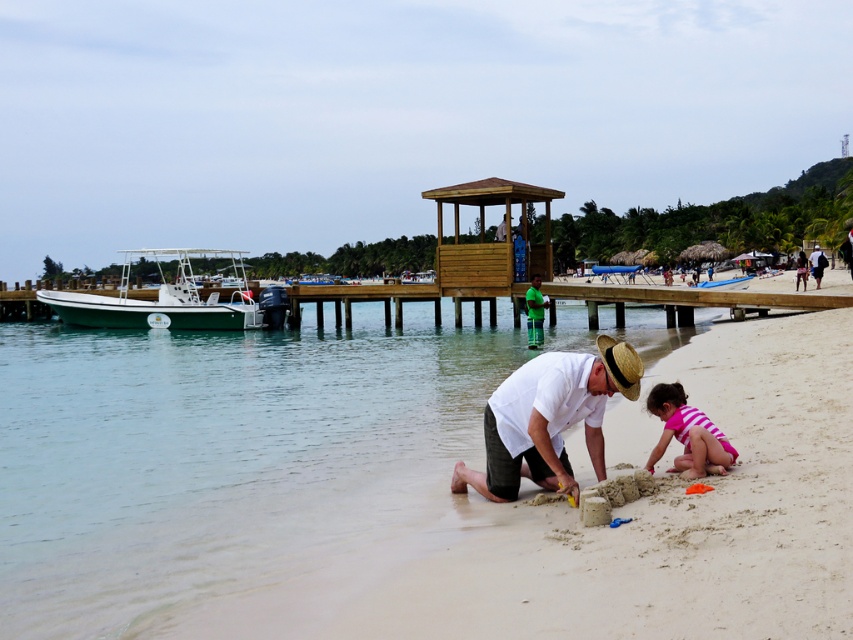
You are a photographer trying to capture a closeup shot of the pink striped swimsuit at lower right and the white cotton shirt at lower right. Since you want to focus on the swimsuit, which object should you position closer to the camera?

The pink striped swimsuit at lower right has a lesser width compared to the white cotton shirt at lower right. To focus on the swimsuit, position it closer to the camera so it appears larger in the frame.

You are a photographer trying to capture the sandcastle scene. You want to focus on the sandcastle and the person building it. However, there is a distracting point at coordinates point (686, 433). Where exactly is this point located in the image?

The point (686, 433) is located on the pink striped swimsuit at lower right, which belongs to the young child participating in building the sandcastle.

You are a photographer trying to capture a closeup of both the white matte shirt at center and the pink striped swimsuit at lower right in the scene. Given their sizes, which one would you need to zoom in more on to ensure both appear similarly sized in the photo?

The white matte shirt at center is bigger than the pink striped swimsuit at lower right, so you would need to zoom in more on the pink striped swimsuit at lower right to make both appear similarly sized in the photo.